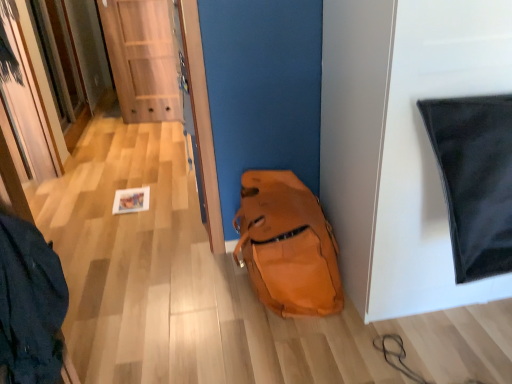
Where is `free space that is to the left of orange leather backpack at lower center`? Image resolution: width=512 pixels, height=384 pixels. free space that is to the left of orange leather backpack at lower center is located at coordinates (176, 302).